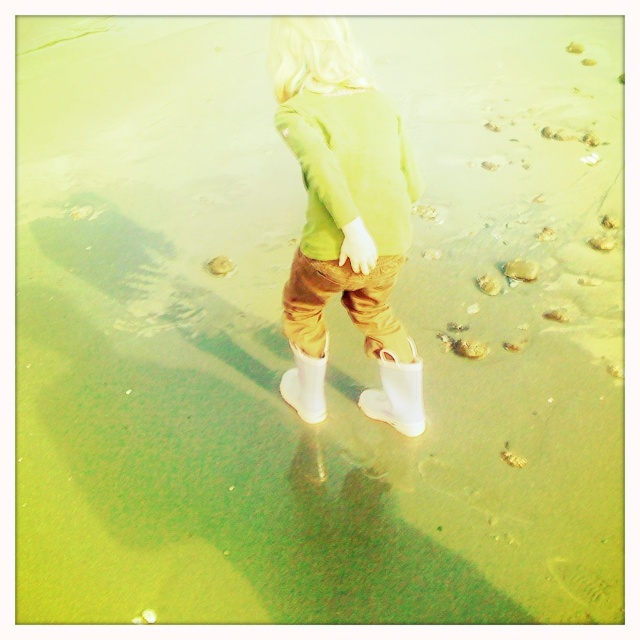
Is matte green sweater at center positioned in front of smooth sand footprint at center?

Yes.

The image size is (640, 640). I want to click on matte green sweater at center, so click(342, 216).

Based on the photo, is matte green sweater at center positioned at the back of white rubber boot at center?

No, matte green sweater at center is in front of white rubber boot at center.

Between matte green sweater at center and white rubber boot at center, which one appears on the right side from the viewer's perspective?

Positioned to the right is matte green sweater at center.

Is point (321, 118) closer to camera compared to point (300, 401)?

Yes.

The width and height of the screenshot is (640, 640). I want to click on matte green sweater at center, so click(x=342, y=216).

Between white rubber boot at lower center and smooth sand footprint at center, which one has more height?

Standing taller between the two is white rubber boot at lower center.

Describe the element at coordinates (396, 394) in the screenshot. I see `white rubber boot at lower center` at that location.

The width and height of the screenshot is (640, 640). I want to click on white rubber boot at lower center, so click(396, 394).